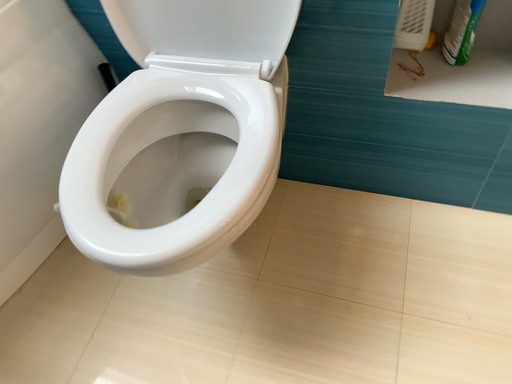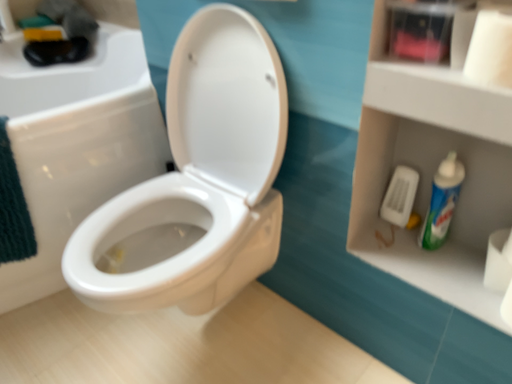
Question: Which way did the camera rotate in the video?

Choices:
 (A) rotated right
 (B) rotated left

Answer: (B)